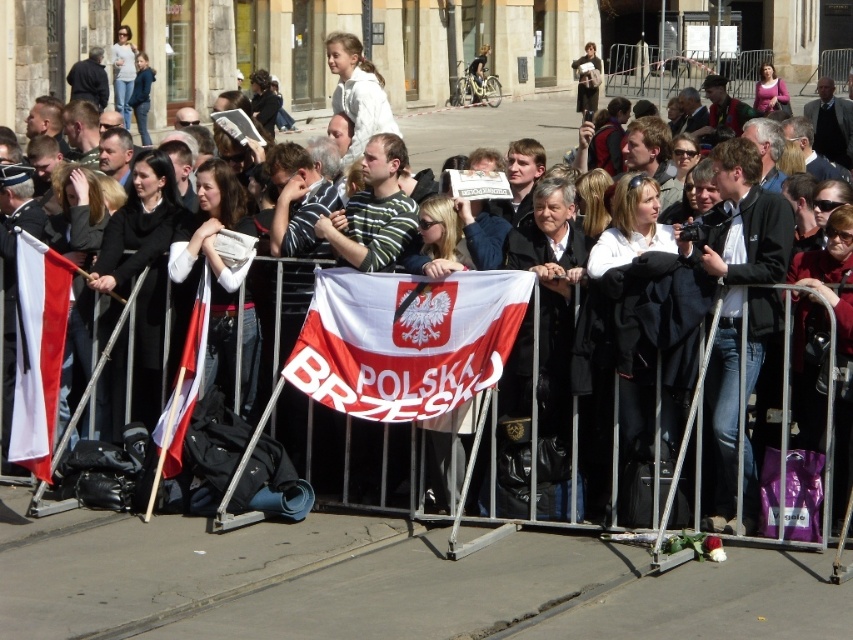
You are standing at the point labeled point (x=351, y=33). You want to walk to the point labeled point (x=33, y=445). Which direction should you move relative to your current position?

You should move forward because point (x=33, y=445) is in front of point (x=351, y=33).

You are standing in the crowd watching the event. You see the white fabric flag at center and the matte black jacket at center. Which object is positioned more to the left from your perspective?

The white fabric flag at center is positioned to the left of the matte black jacket at center, so the white fabric flag at center is more to the left.